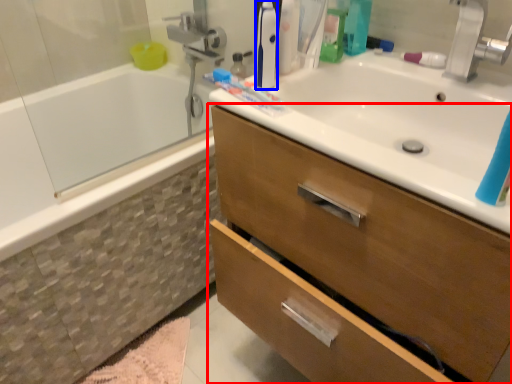
Question: Which object is closer to the camera taking this photo, bathroom cabinet (highlighted by a red box) or toiletry (highlighted by a blue box)?

Choices:
 (A) bathroom cabinet
 (B) toiletry

Answer: (A)